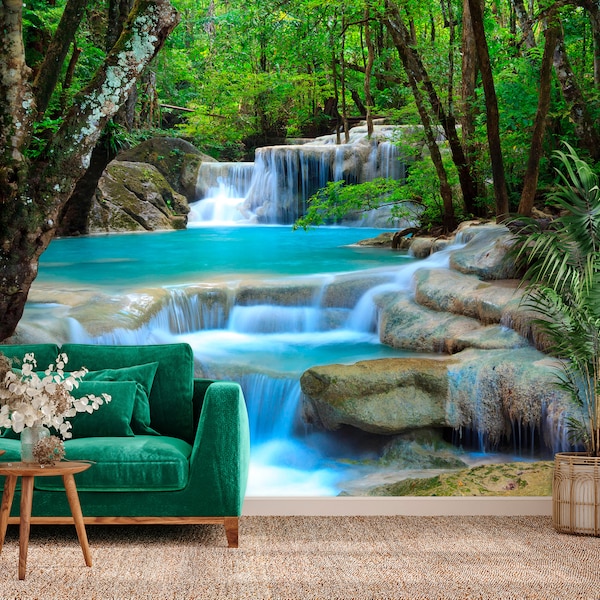
Locate an element on the screen. The width and height of the screenshot is (600, 600). mural is located at coordinates (302, 340).